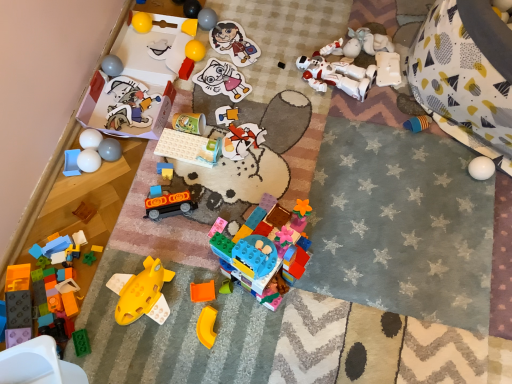
The height and width of the screenshot is (384, 512). What are the coordinates of `vacant space that's between yellow matte block at center, which is counted as the eleventh toy, starting from the left, and matte paper sticker at center, the eighteenth toy positioned from the left` in the screenshot? It's located at (204, 56).